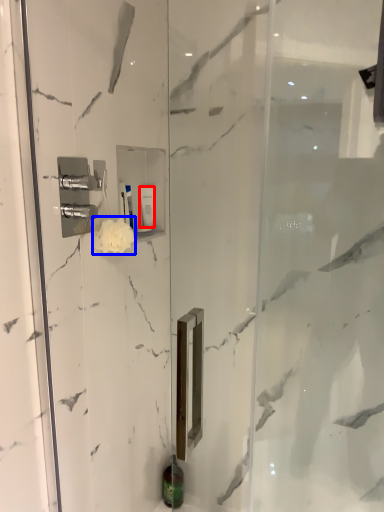
Question: Among these objects, which one is nearest to the camera, toiletry (highlighted by a red box) or flower (highlighted by a blue box)?

Choices:
 (A) toiletry
 (B) flower

Answer: (B)